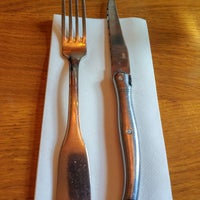
Where is `napkin`? This screenshot has width=200, height=200. napkin is located at coordinates (143, 100).